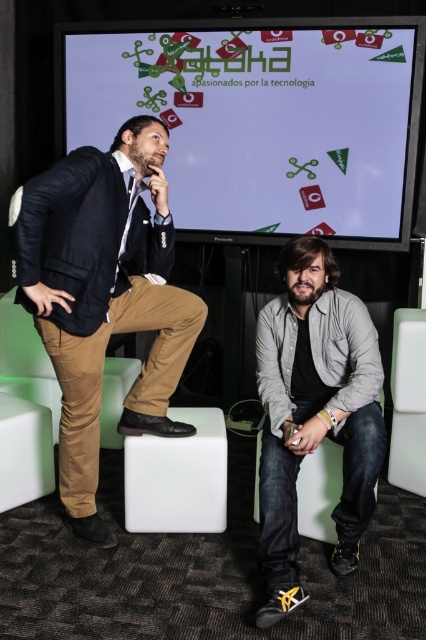
You are setting up a photo shoot in the scene. You need to place a 1.2 meter wide banner between the white glossy screen at upper center and the gray cotton shirt at lower right. Can the banner fit between them horizontally?

Answer: The white glossy screen at upper center is wider than the gray cotton shirt at lower right. However, the exact distance between them isn not specified in the provided description. Therefore, it is uncertain whether the 1.2 meter wide banner can fit horizontally between them.

You are at a tech event and want to look at the white glossy screen at upper center while talking to the person in the dark blue suit at left. Can you see the screen without moving your head?

The white glossy screen at upper center is to the right of the dark blue suit at left, so you can see the screen without moving your head by glancing to your right.